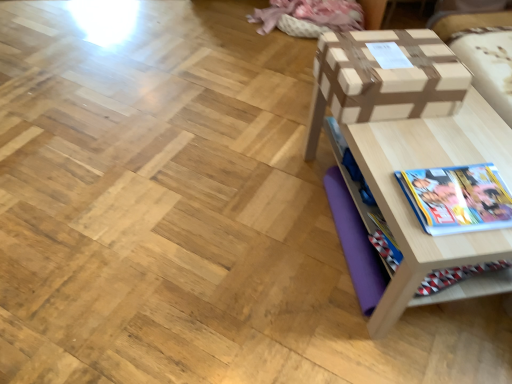
Locate an element on the screen. free space above wooden table at right (from a real-world perspective) is located at coordinates (441, 165).